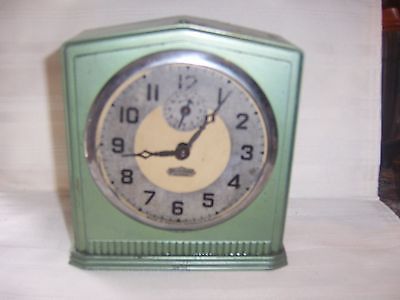
Identify the location of base of clock. The image size is (400, 300). (165, 268).